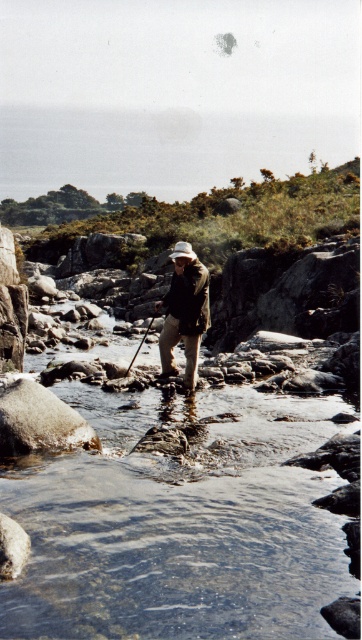
How much distance is there between clear water at center and camouflage jacket at center?

clear water at center and camouflage jacket at center are 9.94 feet apart.

Does clear water at center have a lesser width compared to camouflage jacket at center?

In fact, clear water at center might be wider than camouflage jacket at center.

The width and height of the screenshot is (362, 640). Describe the element at coordinates (178, 522) in the screenshot. I see `clear water at center` at that location.

Where is `clear water at center`? Image resolution: width=362 pixels, height=640 pixels. clear water at center is located at coordinates (178, 522).

Looking at this image, which of these two, clear water at center or wooden fishing pole at center, stands taller?

clear water at center

Does point (201, 547) come farther from viewer compared to point (152, 320)?

No, it is not.

What are the coordinates of `clear water at center` in the screenshot? It's located at (178, 522).

Does camouflage jacket at center appear under wooden fishing pole at center?

Actually, camouflage jacket at center is above wooden fishing pole at center.

Is camouflage jacket at center thinner than wooden fishing pole at center?

Indeed, camouflage jacket at center has a lesser width compared to wooden fishing pole at center.

What do you see at coordinates (183, 312) in the screenshot? The height and width of the screenshot is (640, 362). I see `camouflage jacket at center` at bounding box center [183, 312].

In order to click on camouflage jacket at center in this screenshot , I will do `click(183, 312)`.